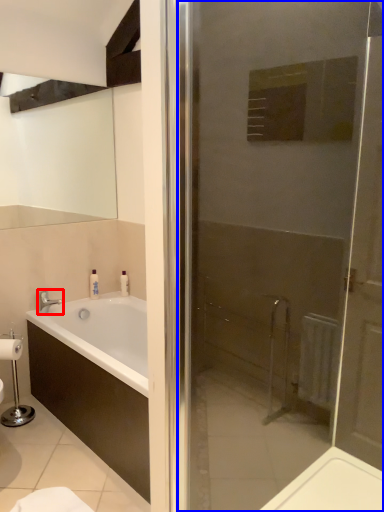
Question: Which point is closer to the camera, tap (highlighted by a red box) or door (highlighted by a blue box)?

Choices:
 (A) tap
 (B) door

Answer: (B)